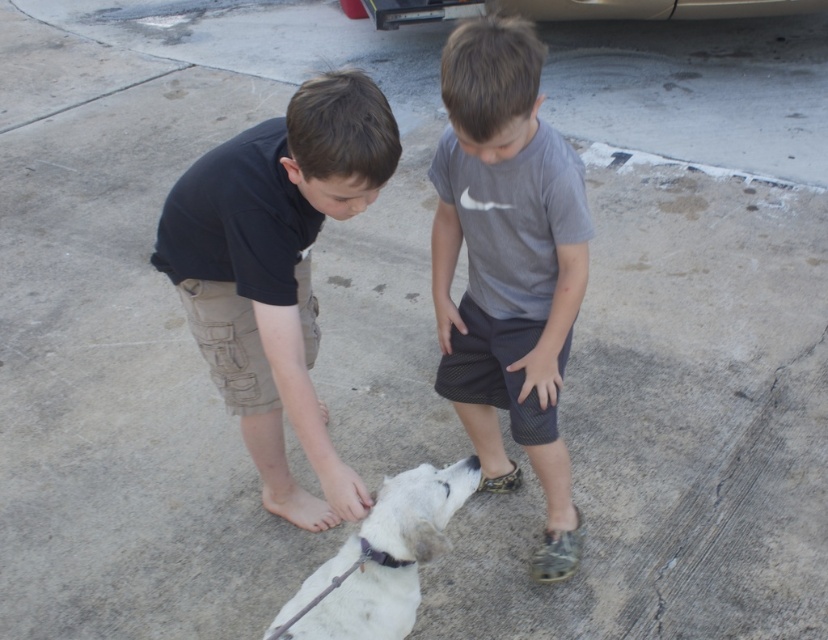
Question: Is dark blue cotton shirt at center thinner than white fur paw at lower center?

Choices:
 (A) no
 (B) yes

Answer: (A)

Question: Based on their relative distances, which object is nearer to the bare skin at lower left?

Choices:
 (A) white fur paw at lower center
 (B) gray cotton shirt at center
 (C) white matte dog at lower center

Answer: (B)

Question: Estimate the real-world distances between objects in this image. Which object is farther from the white fur paw at lower center?

Choices:
 (A) white matte dog at lower center
 (B) gray cotton shirt at center

Answer: (B)

Question: Is gray cotton shirt at center positioned before white matte dog at lower center?

Choices:
 (A) no
 (B) yes

Answer: (A)

Question: Can you confirm if dark blue cotton shirt at center is wider than white matte dog at lower center?

Choices:
 (A) yes
 (B) no

Answer: (A)

Question: Which of these objects is positioned farthest from the white fur paw at lower center?

Choices:
 (A) white matte dog at lower center
 (B) gray cotton shirt at center

Answer: (B)